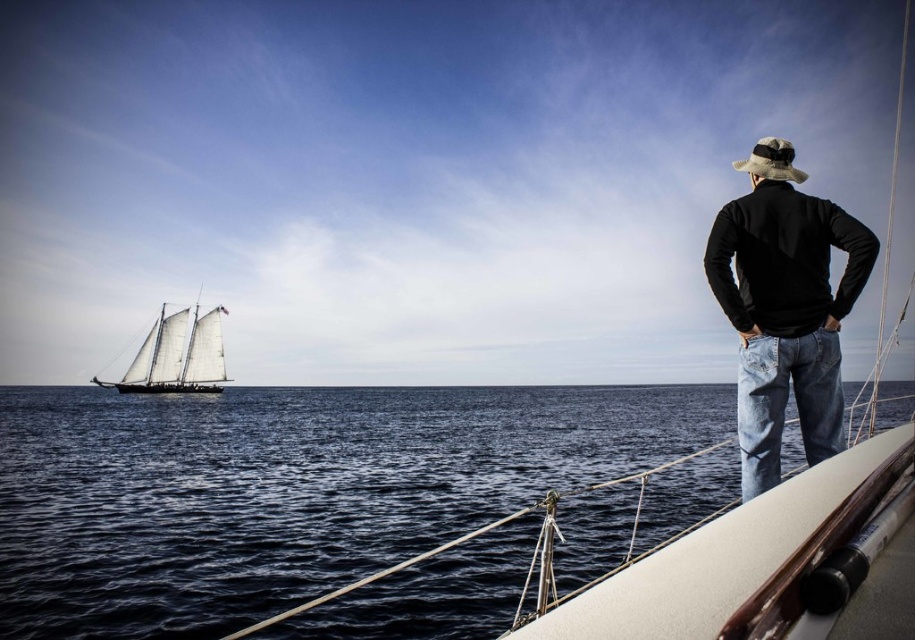
You are a sailor on the deck of the sailboat. You notice the dark blue water at center and the white canvas sailboat at left. Which object is nearer to you?

The dark blue water at center is closer to the viewer than the white canvas sailboat at left.

You are a sailor on the deck of the sailboat and you need to retrieve an item that fell into the dark blue water at center. Which direction should you move relative to the black matte jacket at upper right?

The dark blue water at center is positioned on the left side of the black matte jacket at upper right, so you should move to the left relative to the black matte jacket at upper right to reach the dark blue water at center.

You are navigating a sailboat and need to determine the position of two points on your radar. The first point is labeled as point (593, 534) and the second as point (782, 227). According to the scene, which point is located behind the other?

Point (593, 534) is behind point (782, 227).